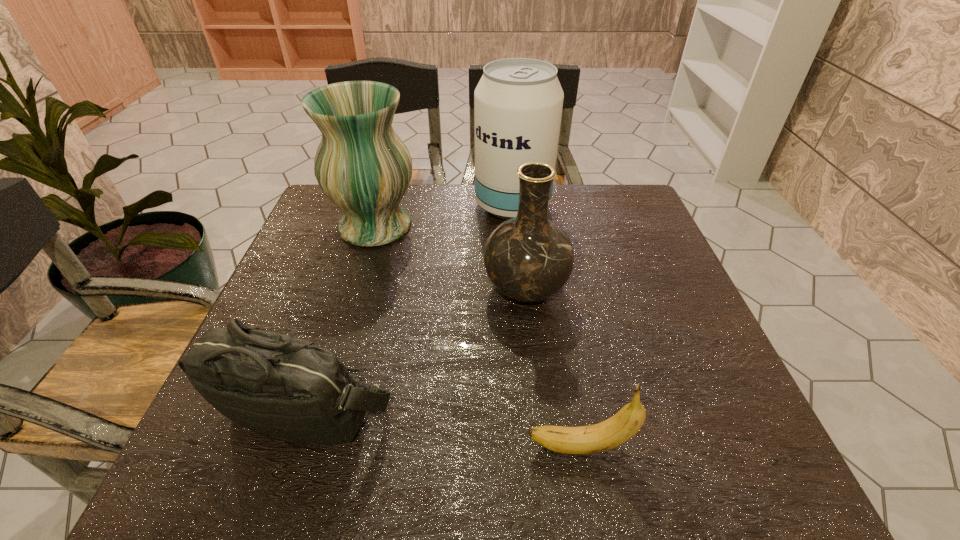
You are a GUI agent. You are given a task and a screenshot of the screen. Output one action in this format:
    pyautogui.click(x=<x>, y=<y>)
    Task: Click on the free region at the far edge of the desktop
    This screenshot has height=540, width=960.
    Given the screenshot: What is the action you would take?
    pyautogui.click(x=480, y=215)

Where is `blank space at the near edge of the desktop`? This screenshot has height=540, width=960. blank space at the near edge of the desktop is located at coordinates (484, 456).

Find the location of a particular element. The image size is (960, 540). vacant space at the left edge is located at coordinates (333, 280).

Image resolution: width=960 pixels, height=540 pixels. I want to click on vacant position at the far right corner of the desktop, so click(619, 205).

Locate an element on the screen. This screenshot has height=540, width=960. vacant area at the near right corner of the desktop is located at coordinates pyautogui.click(x=705, y=467).

Image resolution: width=960 pixels, height=540 pixels. What are the coordinates of `vacant area that lies between the left vase and the right vase` in the screenshot? It's located at (450, 258).

Where is `unoccupied position between the fourth tallest object and the banana`? This screenshot has height=540, width=960. unoccupied position between the fourth tallest object and the banana is located at coordinates (443, 428).

At what (x,y) coordinates should I click in order to perform the action: click on empty location between the fourth tallest object and the left vase. Please return your answer as a coordinate pair (x, y). This screenshot has height=540, width=960. Looking at the image, I should click on (340, 318).

Where is `free area in between the alcohol and the left vase`? free area in between the alcohol and the left vase is located at coordinates (444, 216).

Find the location of `vacant region between the right vase and the banana`. vacant region between the right vase and the banana is located at coordinates (553, 368).